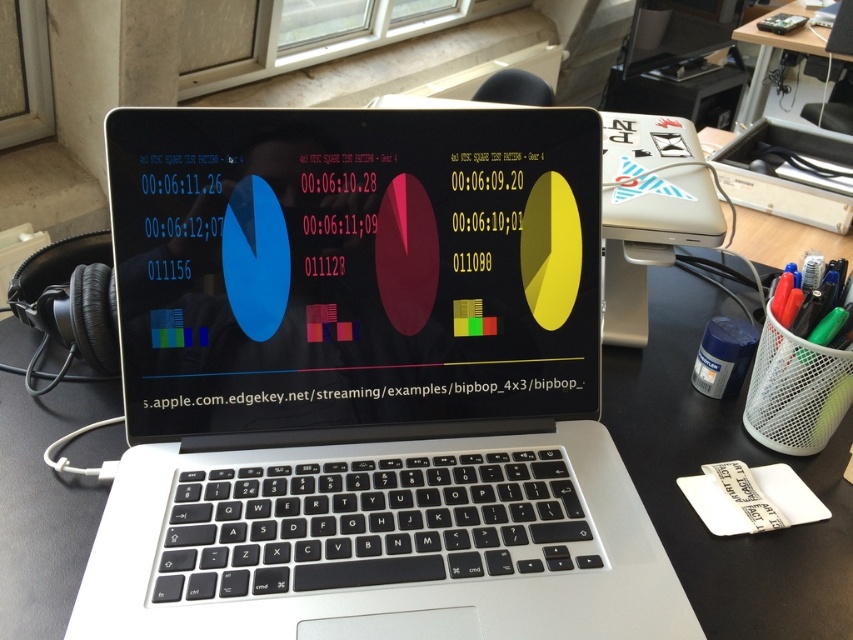
You are setting up a video conference. The silver metallic laptop at center is your main device. You need to place it so that the camera faces directly towards you. Given the current position of the silver metallic laptop at center at point [364,385], where should you position yourself relative to this point to ensure optimal camera alignment?

To ensure optimal camera alignment, you should position yourself directly in front of the silver metallic laptop at center at point [364,385] so that the camera faces you head on.

You are organizing your desk and need to place a new item between the green matte pen at right and the wooden table at upper right. Where should you place it to ensure it is between them?

Place the new item between the green matte pen at right and the wooden table at upper right. Since the green matte pen at right is on the left side of the wooden table at upper right, the item should be placed to the right of the green matte pen at right and to the left of the wooden table at upper right.

You are organizing your desk and need to place a new item between the silver metallic laptop at center and the green matte pen at right. Where should you place it?

Place the new item between the silver metallic laptop at center and the green matte pen at right, to the right of the laptop and to the left of the pen since the laptop is to the left of the pen.